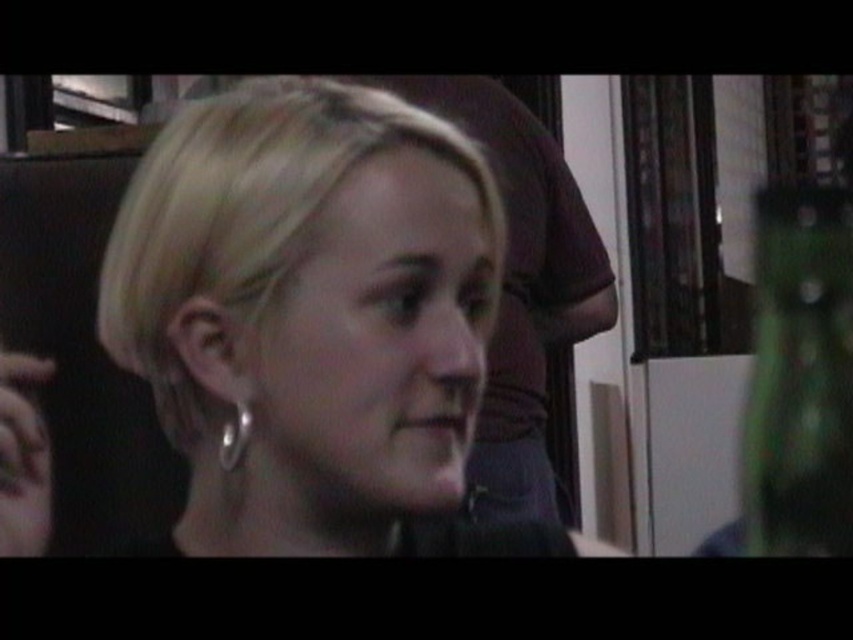
Question: Can you confirm if smooth skin face at center is thinner than green glass bottle at right?

Choices:
 (A) yes
 (B) no

Answer: (A)

Question: Estimate the real-world distances between objects in this image. Which object is farther from the silver metallic earring at lower left?

Choices:
 (A) smooth skin face at center
 (B) blonde hair at center

Answer: (A)

Question: Among these points, which one is nearest to the camera?

Choices:
 (A) (231, 444)
 (B) (746, 474)
 (C) (520, 486)
 (D) (299, 364)

Answer: (D)

Question: Does blonde hair at center have a lesser width compared to silver metallic earring at lower left?

Choices:
 (A) no
 (B) yes

Answer: (A)

Question: Which of these objects is positioned closest to the smooth skin face at center?

Choices:
 (A) green glass bottle at right
 (B) silver metallic earring at lower left

Answer: (B)

Question: Can you confirm if blonde hair at center is smaller than smooth skin face at center?

Choices:
 (A) no
 (B) yes

Answer: (B)